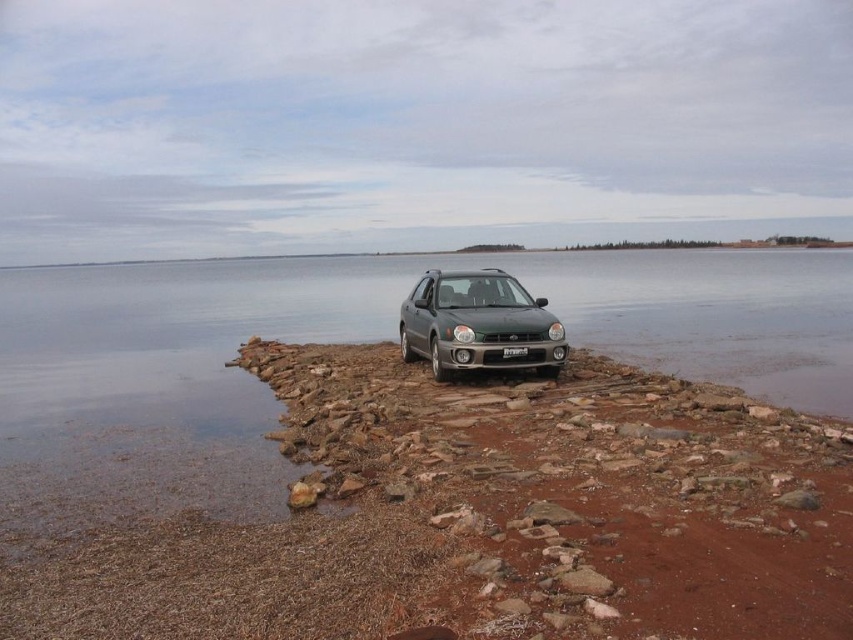
You are a photographer trying to capture the satin silver metallic hatchback at center and the white plastic license plate at center in your shot. Based on their positions, which object would appear closer to the camera in the photo?

The satin silver metallic hatchback at center appears closer to the camera because it is positioned in front of the white plastic license plate at center.

You are a photographer planning to take a picture of the satin silver metallic hatchback at center and the white plastic license plate at center. If you want both objects to be clearly visible in the frame, which object should you focus on first to ensure proper focus?

You should focus on the satin silver metallic hatchback at center first because it is wider than the white plastic license plate at center, ensuring that the larger object is in focus before adjusting for the smaller one.

You are a parking attendant checking if vehicles are properly aligned. The satin silver metallic hatchback at center must be parked so its license plate is fully visible. Is the white plastic license plate at center currently visible?

The satin silver metallic hatchback at center is positioned over white plastic license plate at center, so the license plate is not fully visible.